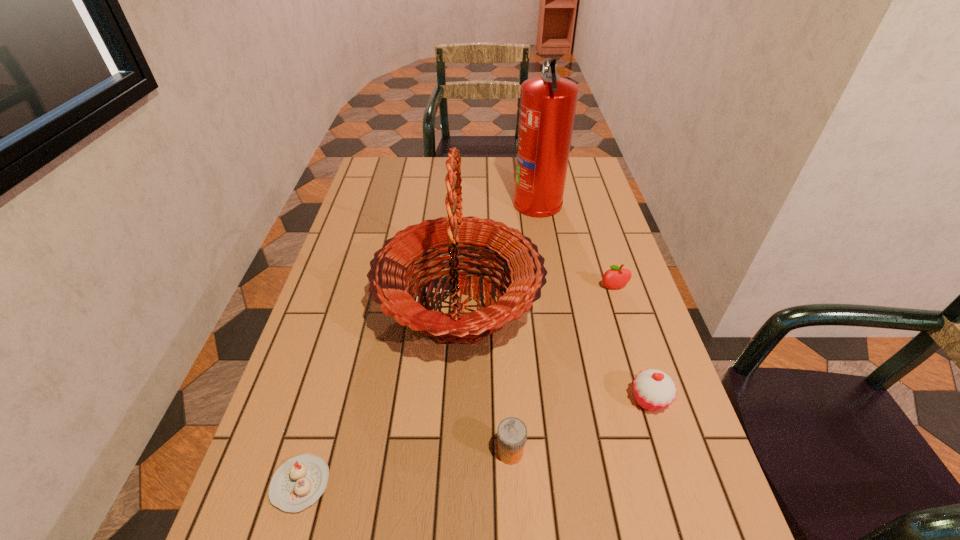
The width and height of the screenshot is (960, 540). I want to click on fire extinguisher present at the right edge, so click(548, 103).

I want to click on cupcake that is positioned at the right edge, so click(654, 390).

Where is `apple that is at the right edge`? Image resolution: width=960 pixels, height=540 pixels. apple that is at the right edge is located at coordinates (617, 277).

I want to click on object at the far right corner, so click(548, 103).

Identify the location of free space at the far edge. This screenshot has height=540, width=960. (470, 166).

The image size is (960, 540). In order to click on vacant space at the left edge in this screenshot , I will do `click(370, 309)`.

Find the location of a particular element. This screenshot has width=960, height=540. free space at the right edge of the desktop is located at coordinates (660, 435).

You are a GUI agent. You are given a task and a screenshot of the screen. Output one action in this format:
    pyautogui.click(x=<x>, y=<y>)
    Task: Click on the free space between the farthest object and the medicine
    This screenshot has width=960, height=540.
    Given the screenshot: What is the action you would take?
    pyautogui.click(x=524, y=327)

The height and width of the screenshot is (540, 960). I want to click on free space between the apple and the medicine, so coord(562,370).

Where is `vacant area between the fire extinguisher and the medicine`? The height and width of the screenshot is (540, 960). vacant area between the fire extinguisher and the medicine is located at coordinates (524, 327).